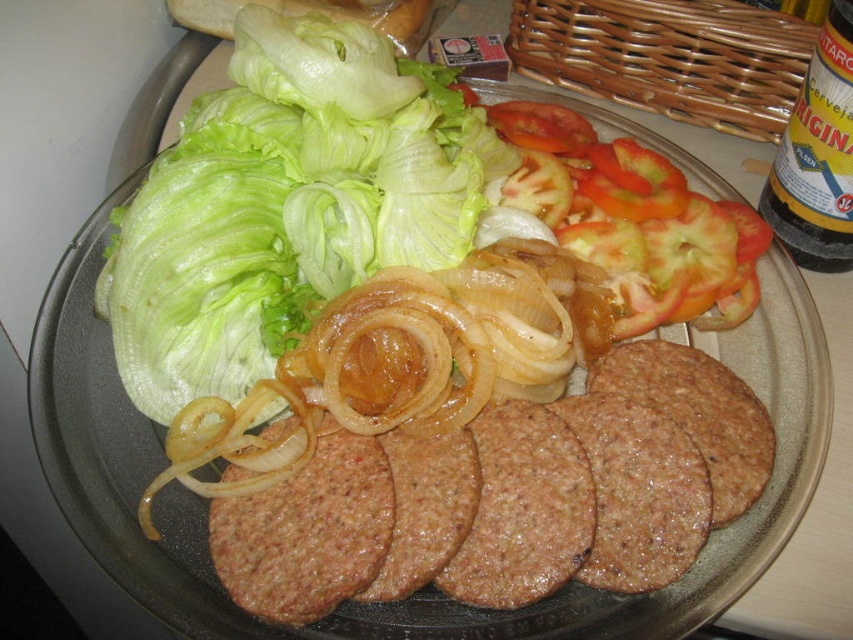
You are a food stylist arranging a plate. The brown textured meat at center needs to be visible for the photo. Is the sliced red tomato at upper right blocking it?

The brown textured meat at center is positioned under the sliced red tomato at upper right, so the tomato is blocking the meat.